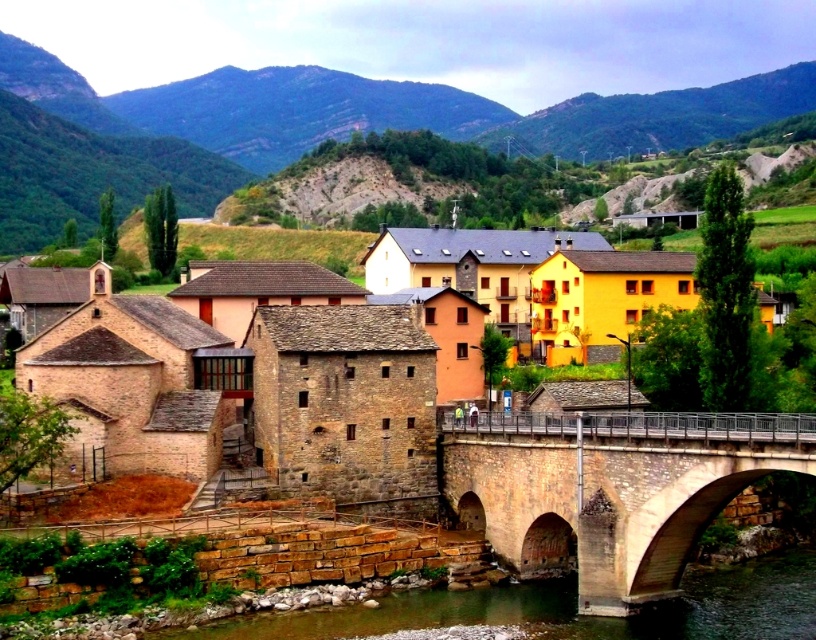
You are standing at the stone bridge in the village and want to walk towards the green grassy hillside at upper center. Which direction should you head relative to the brown stone river at lower center?

The green grassy hillside at upper center is positioned on the left side of brown stone river at lower center, so you should head to the left side of the brown stone river at lower center to reach it.

You are standing at the stone bridge in the village and looking towards the cluster of buildings. There are two points marked in the image, point A at coordinates point A is point (370, 484) and point B is point (686, 99). Which point is closer to you?

Point A at coordinates point A is point (370, 484) is closer to you than point B at coordinates point B is point (686, 99) because it is closer to the camera.